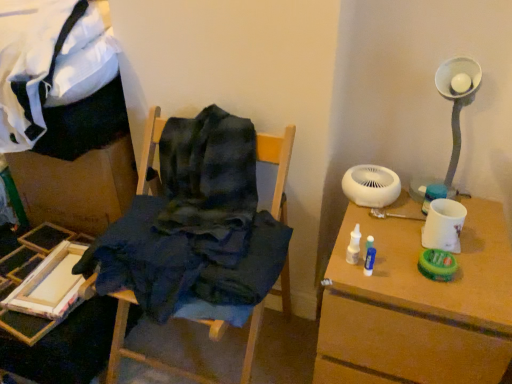
Question: Is wooden paint tray at lower left, the first furniture in the left-to-right sequence, to the right of dark blue fabric at center, the 1th furniture when ordered from right to left, from the viewer's perspective?

Choices:
 (A) no
 (B) yes

Answer: (A)

Question: Is wooden paint tray at lower left, which ranks as the 2th furniture in right-to-left order, not within dark blue fabric at center, the 1th furniture when ordered from right to left?

Choices:
 (A) no
 (B) yes

Answer: (B)

Question: Is wooden paint tray at lower left, which ranks as the 2th furniture in right-to-left order, thinner than dark blue fabric at center, the 1th furniture when ordered from right to left?

Choices:
 (A) yes
 (B) no

Answer: (A)

Question: Can you confirm if wooden paint tray at lower left, the first furniture in the left-to-right sequence, is bigger than dark blue fabric at center, which is counted as the 2th furniture, starting from the left?

Choices:
 (A) yes
 (B) no

Answer: (B)

Question: Is wooden paint tray at lower left, which ranks as the 2th furniture in right-to-left order, wider than dark blue fabric at center, which is counted as the 2th furniture, starting from the left?

Choices:
 (A) yes
 (B) no

Answer: (B)

Question: Does wooden paint tray at lower left, which ranks as the 2th furniture in right-to-left order, have a smaller size compared to dark blue fabric at center, the 1th furniture when ordered from right to left?

Choices:
 (A) yes
 (B) no

Answer: (A)

Question: Is dark blue fabric at center, which is counted as the 2th furniture, starting from the left, looking in the opposite direction of white matte table at right?

Choices:
 (A) no
 (B) yes

Answer: (A)

Question: Considering the relative sizes of dark blue fabric at center, which is counted as the 2th furniture, starting from the left, and white matte table at right in the image provided, is dark blue fabric at center, which is counted as the 2th furniture, starting from the left, bigger than white matte table at right?

Choices:
 (A) no
 (B) yes

Answer: (B)

Question: Does dark blue fabric at center, which is counted as the 2th furniture, starting from the left, lie behind white matte table at right?

Choices:
 (A) no
 (B) yes

Answer: (A)

Question: Is white matte table at right inside dark blue fabric at center, which is counted as the 2th furniture, starting from the left?

Choices:
 (A) no
 (B) yes

Answer: (A)

Question: Is dark blue fabric at center, the 1th furniture when ordered from right to left, not within white matte table at right?

Choices:
 (A) no
 (B) yes

Answer: (B)

Question: Is dark blue fabric at center, which is counted as the 2th furniture, starting from the left, closer to camera compared to white matte table at right?

Choices:
 (A) no
 (B) yes

Answer: (B)

Question: Does white matte table at right have a larger size compared to dark blue fabric at center, the 1th furniture when ordered from right to left?

Choices:
 (A) no
 (B) yes

Answer: (A)